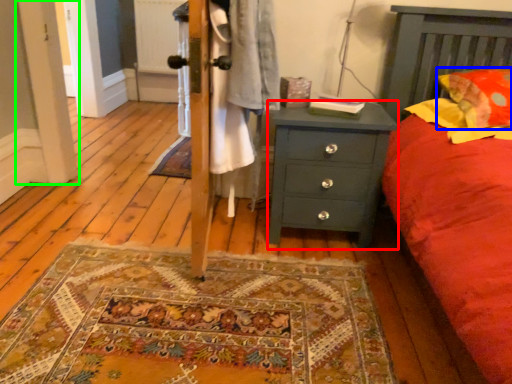
Question: Which object is positioned farthest from chest of drawers (highlighted by a red box)? Select from pillow (highlighted by a blue box) and screen door (highlighted by a green box).

Choices:
 (A) pillow
 (B) screen door

Answer: (B)